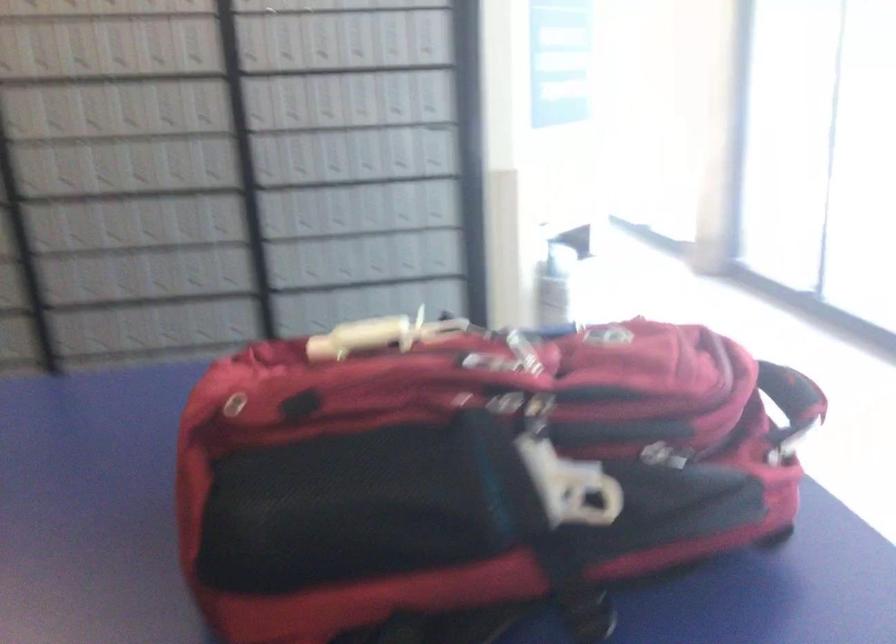
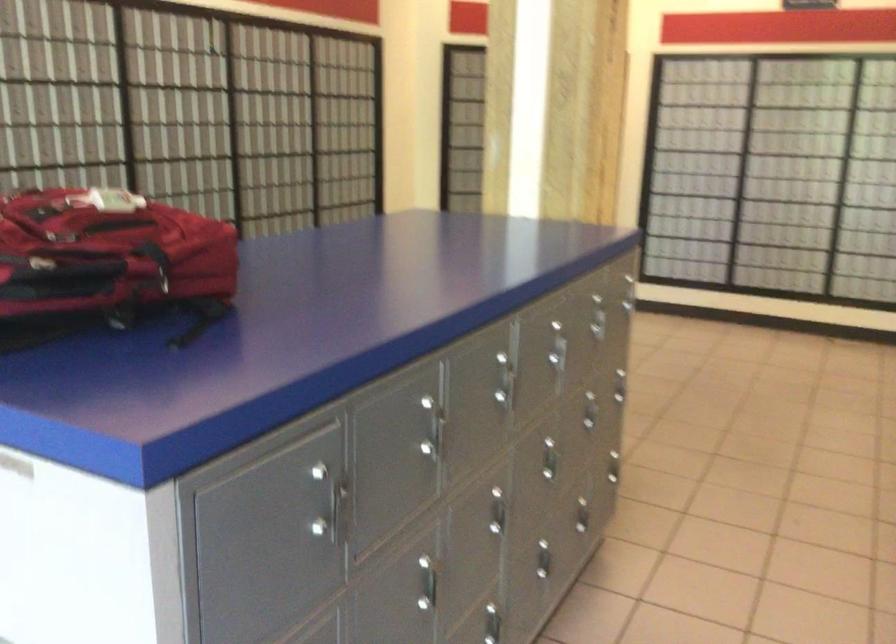
Find the pixel in the second image that matches (424,353) in the first image.

(156, 263)